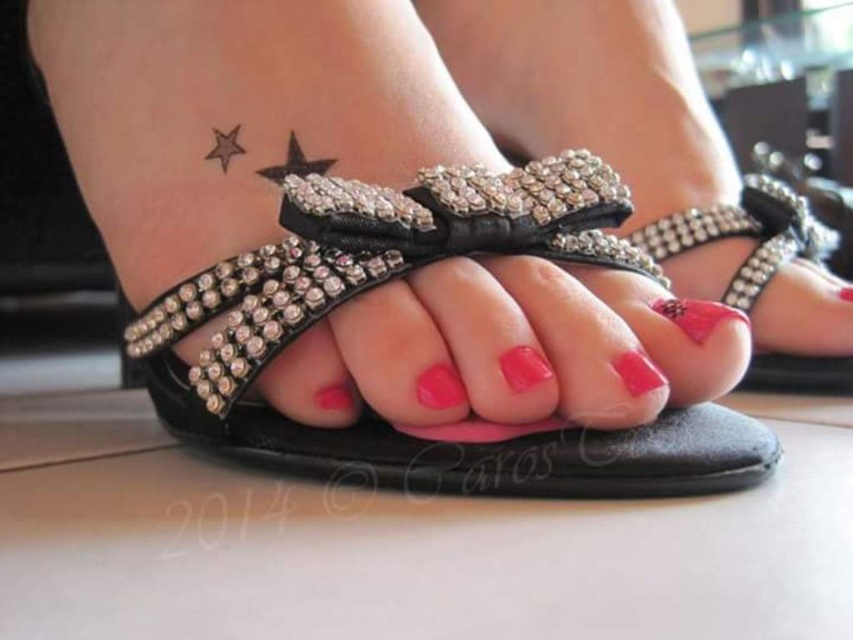
You are a photographer setting up a shoot focusing on footwear. You want to ensure the black leather sandal at center is visible without being blocked by the pink glossy nail at center. Based on the scene, is this arrangement possible?

The black leather sandal at center is located above the pink glossy nail at center, so the sandal will not be blocked by the nail, making it visible in the photo.

You are a photographer setting up a shoot in an indoor studio. You need to position a spotlight exactly at the center of the matte black sandals at center. According to the coordinates provided, where should you aim the spotlight?

The spotlight should be aimed at point (646, 148) to hit the center of the matte black sandals at center.